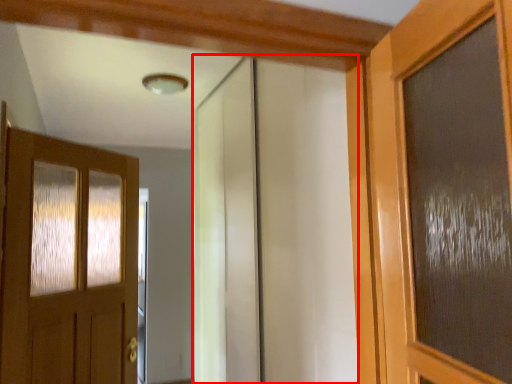
Question: Where is elevator (annotated by the red box) located in relation to door in the image?

Choices:
 (A) right
 (B) left

Answer: (A)